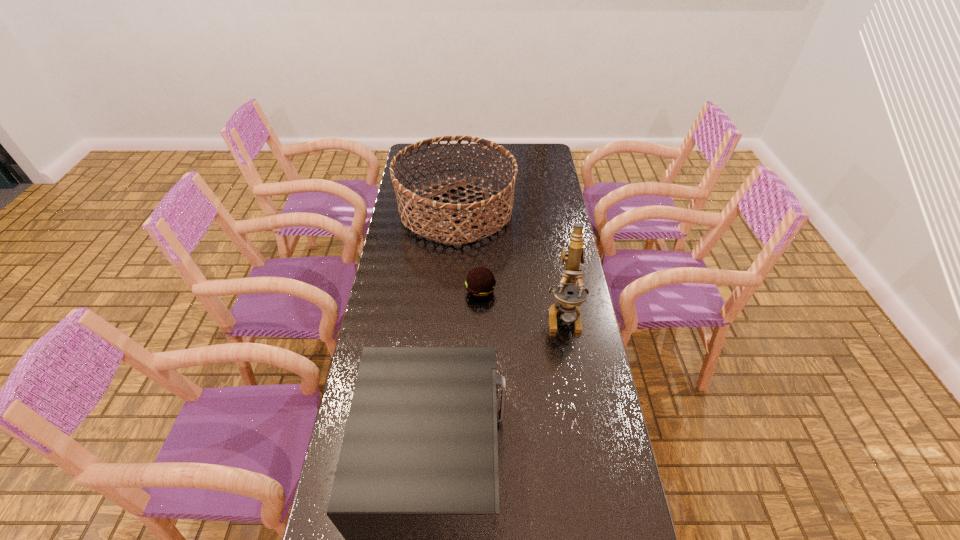
The height and width of the screenshot is (540, 960). I want to click on microscope, so [567, 303].

Locate an element on the screen. This screenshot has width=960, height=540. the rightmost object is located at coordinates (567, 303).

Locate an element on the screen. This screenshot has width=960, height=540. the farthest object is located at coordinates (489, 214).

Where is `patty`? The image size is (960, 540). patty is located at coordinates (480, 282).

Find the location of a particular element. This screenshot has width=960, height=540. free location located on the left of the tallest object is located at coordinates (527, 315).

This screenshot has height=540, width=960. Identify the location of blank space located 0.160m on the right of the basket. coord(552,211).

What are the coordinates of `vacant space situated on the left of the shortest object` in the screenshot? It's located at (406, 291).

Locate an element on the screen. object present at the left edge is located at coordinates (489, 214).

The width and height of the screenshot is (960, 540). I want to click on object at the right edge, so click(567, 303).

Locate an element on the screen. The height and width of the screenshot is (540, 960). vacant space at the far edge of the desktop is located at coordinates (501, 154).